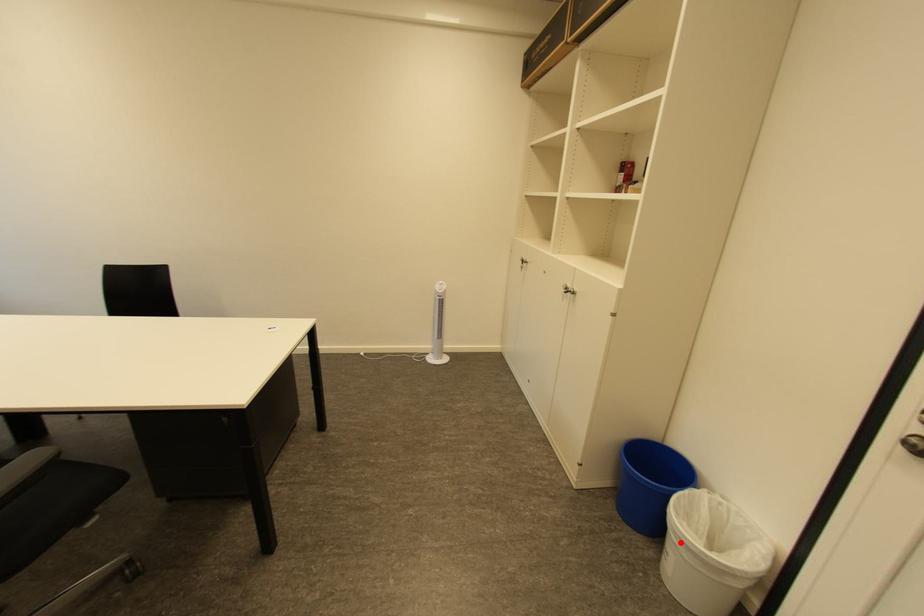
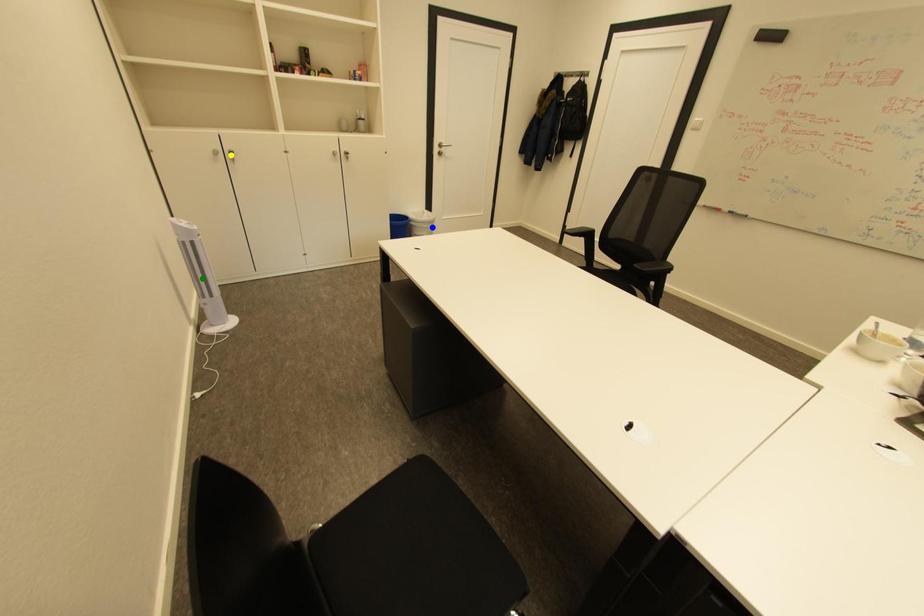
Question: I am providing you with two images of the same scene from different viewpoints. A red point is marked on the first image. You are given multiple points on the second image. Which spot in image 2 lines up with the point in image 1?

Choices:
 (A) green point
 (B) blue point
 (C) yellow point

Answer: (B)